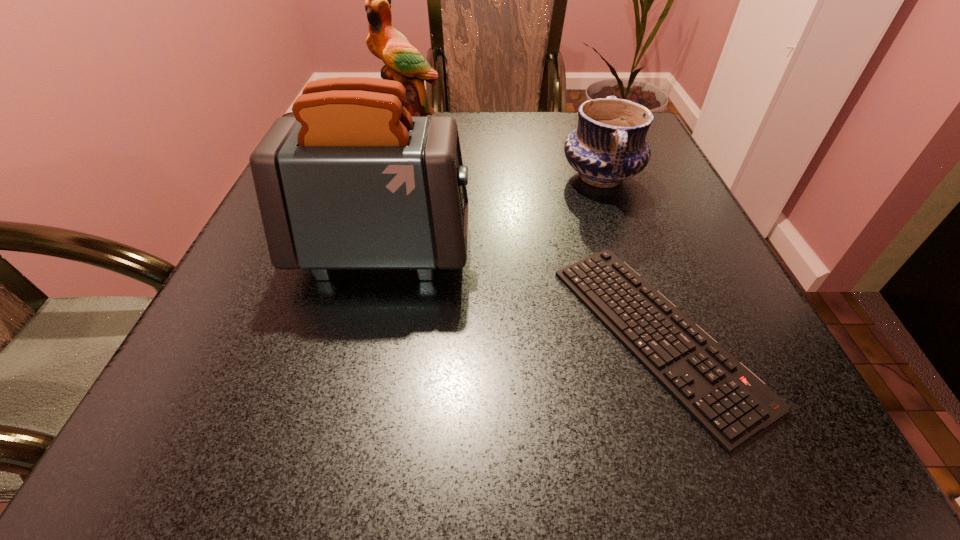
This screenshot has width=960, height=540. I want to click on vacant area that satisfies the following two spatial constraints: 1. on the front-facing side of the parrot; 2. on the right side of the shortest object, so click(358, 334).

Where is `vacant region that satisfies the following two spatial constraints: 1. on the front side of the second farthest object; 2. on the front-facing side of the toaster`? The height and width of the screenshot is (540, 960). vacant region that satisfies the following two spatial constraints: 1. on the front side of the second farthest object; 2. on the front-facing side of the toaster is located at coordinates (628, 251).